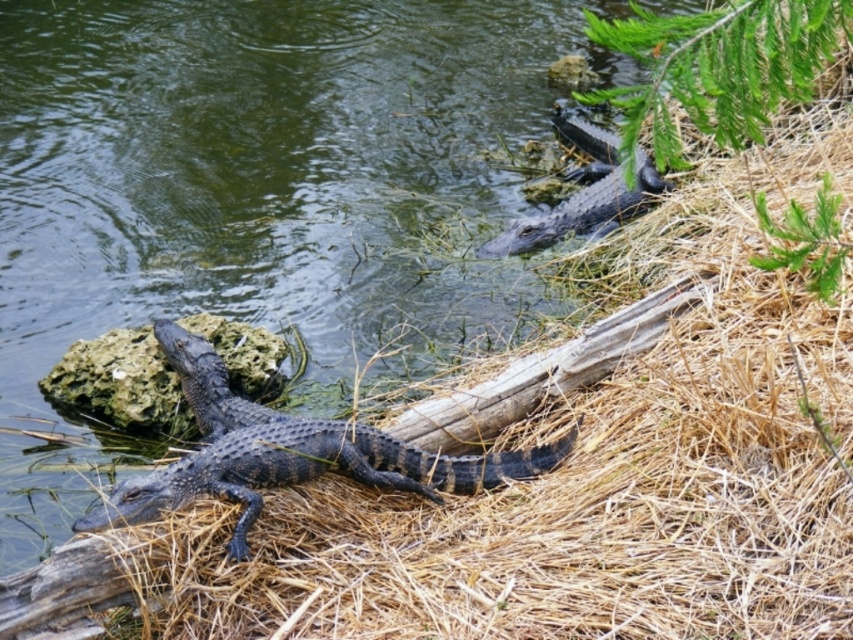
You are a wildlife photographer aiming to capture a clear image of the shiny black crocodile at center and the gray rock at center. Which object is located to the right of the other?

The shiny black crocodile at center is positioned on the right side of gray rock at center.

You are a wildlife photographer aiming to capture a clear photo of the gray rock at center and the shiny black crocodile at upper right. Which object is shorter in height?

The gray rock at center has a lesser height compared to the shiny black crocodile at upper right, so the gray rock at center is shorter in height.

You are standing in the wetland and want to approach the two points marked in the scene. Which point, point (235, 556) or point (614, 205), is closer to you?

Point (235, 556) is closer to the viewer than point (614, 205).